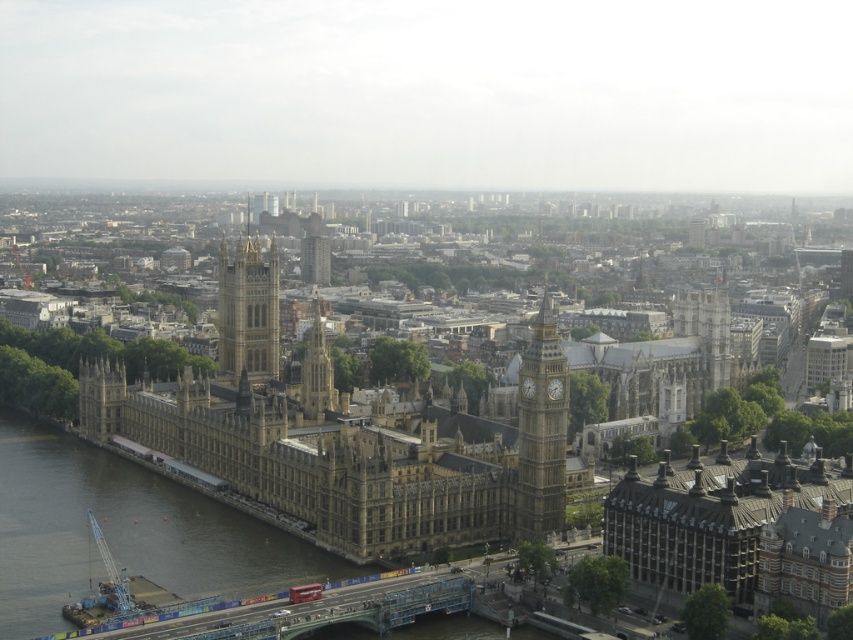
Question: Does dark gray stone building at lower right come behind stone clock tower at center-right?

Choices:
 (A) no
 (B) yes

Answer: (A)

Question: Estimate the real-world distances between objects in this image. Which object is closer to the smooth concrete waterway at lower left?

Choices:
 (A) dark gray stone building at lower right
 (B) stone clock tower at center-right

Answer: (A)

Question: Does dark gray stone building at lower right come behind golden stone tower at center?

Choices:
 (A) no
 (B) yes

Answer: (A)

Question: Among these points, which one is nearest to the camera?

Choices:
 (A) (683, 577)
 (B) (526, 412)
 (C) (238, 595)
 (D) (222, 280)

Answer: (A)

Question: Which of the following is the closest to the observer?

Choices:
 (A) (282, 576)
 (B) (679, 534)

Answer: (B)

Question: Does smooth concrete waterway at lower left come in front of stone clock tower at center-right?

Choices:
 (A) yes
 (B) no

Answer: (A)